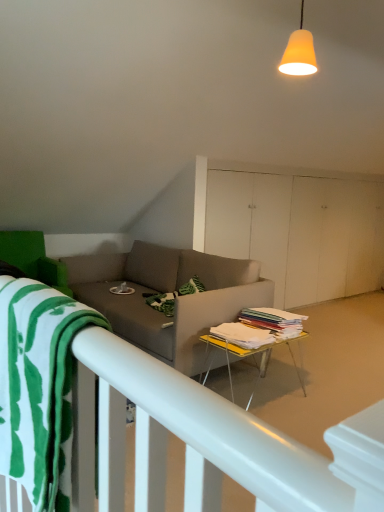
Find the location of a particular element. vacant space to the right of yellow plastic table at center is located at coordinates (327, 390).